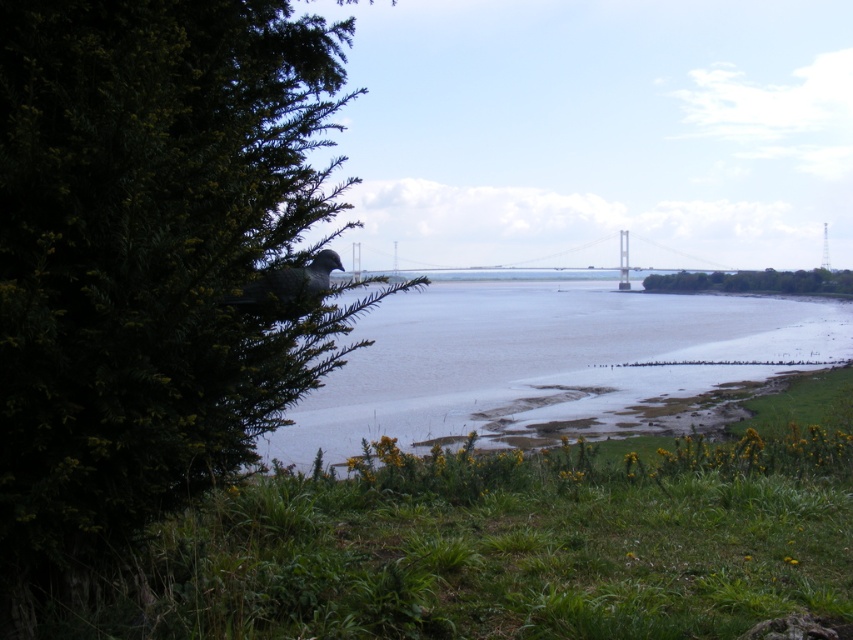
You are standing at the point labeled point (547, 362). Which direction should you walk to reach the gray concrete waterway at center?

The gray concrete waterway at center is represented by point (547, 362), so you are already at the gray concrete waterway at center.

You are standing at the riverside and want to take a photo of both the dense bush with small yellow flowers on the left and the birds along the water edge. The dense bush with small yellow flowers on the left is at point (242, 211) and the birds along the water edge are at point (561, 312). Since you can only focus on one point at a time, which point should you choose to ensure that both the dense bush with small yellow flowers on the left and the birds along the water edge are in focus?

You should focus on point (242, 211) because it is closer to the camera than point (561, 312). By focusing on the closer point, the depth of field may extend to include the farther point, allowing both the dense bush with small yellow flowers on the left and the birds along the water edge to be in focus.